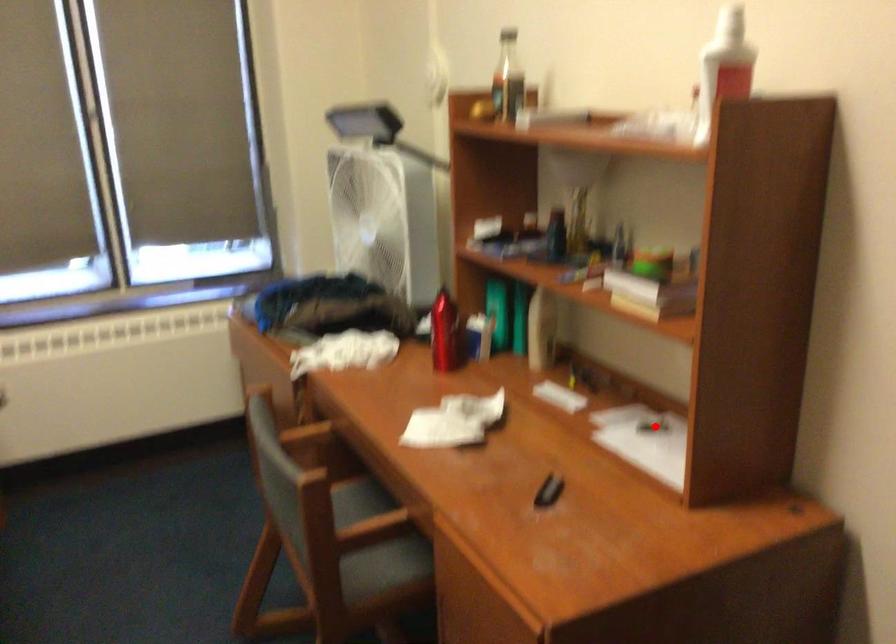
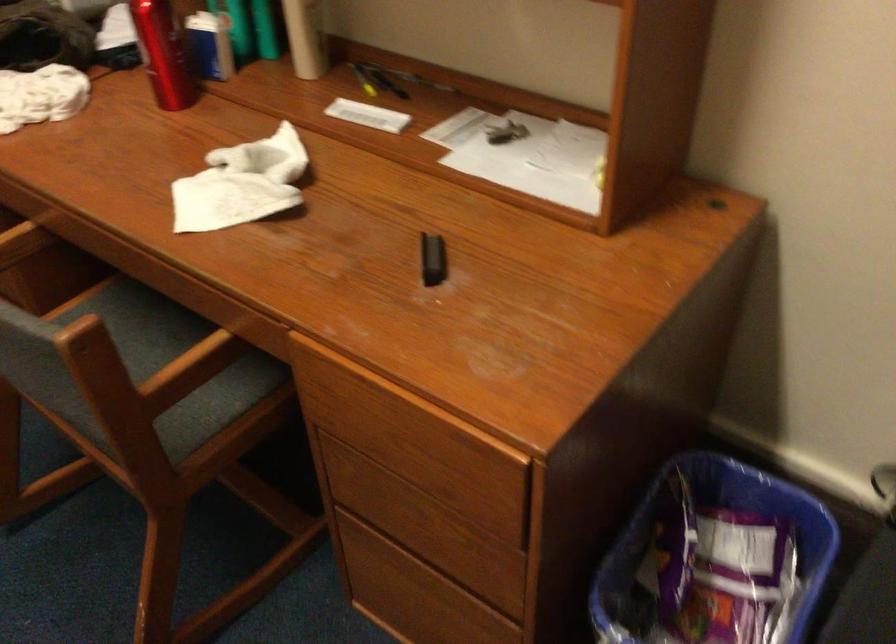
Locate, in the second image, the point that corresponds to the highlighted location in the first image.

(504, 131)